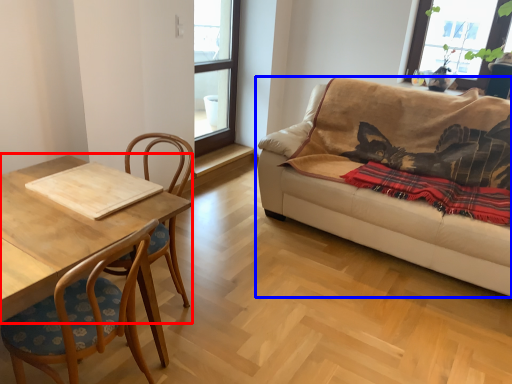
Question: Which of the following is the closest to the observer, coffee table (highlighted by a red box) or studio couch (highlighted by a blue box)?

Choices:
 (A) coffee table
 (B) studio couch

Answer: (A)